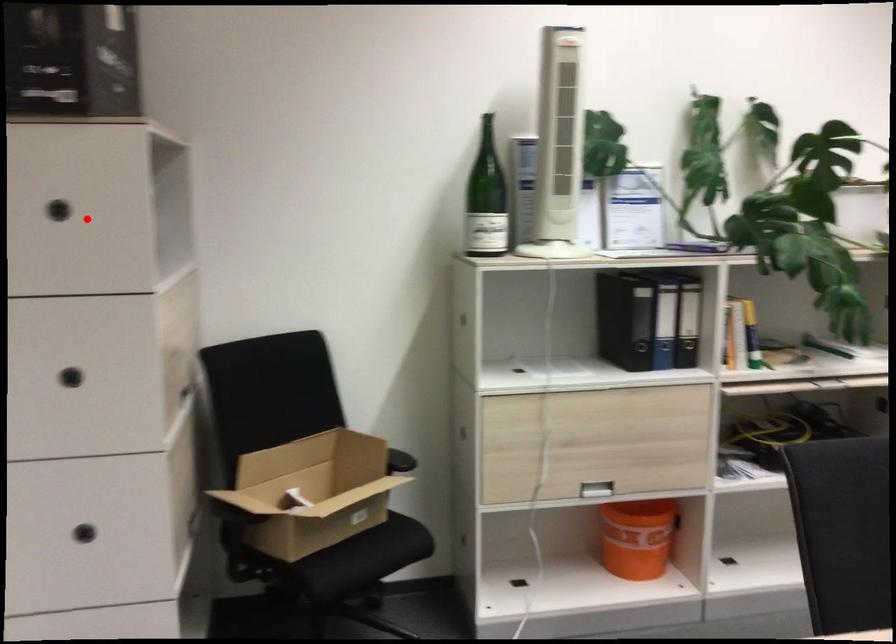
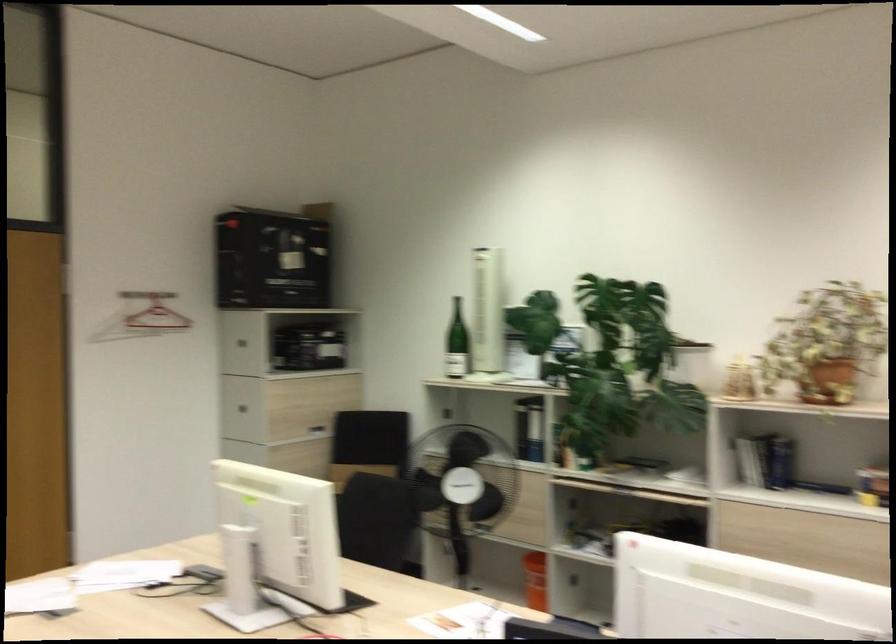
Question: I am providing you with two images of the same scene from different viewpoints. Image1 has a red point marked. In image2, the corresponding 3D location appears at what relative position? Reply with the corresponding letter.

Choices:
 (A) Closer
 (B) Farther

Answer: (B)